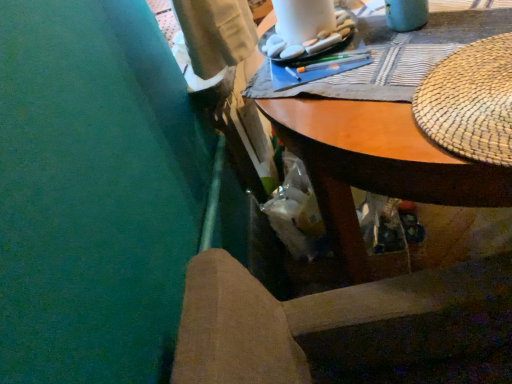
At what (x,y) coordinates should I click in order to perform the action: click on free space in front of white matte rocks at upper center. Please return your answer as a coordinate pair (x, y). This screenshot has height=384, width=512. Looking at the image, I should click on (341, 67).